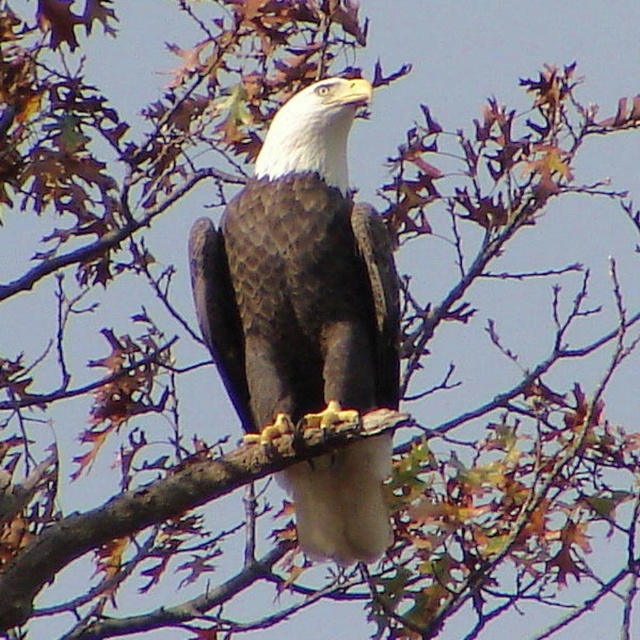
You are an ornithologist observing a bald eagle in its natural habitat. You notice the brown textured feathers at center and the brown rough tree branch at center. Which object occupies more space in the image?

The brown textured feathers at center is larger in size than the brown rough tree branch at center, so it occupies more space in the image.

You are a birdwatcher observing a bald eagle in its natural habitat. You notice a specific point marked at coordinates point (300,278). Based on the scene description, can you determine what part of the eagle this point is located on?

The point (300,278) is on brown textured feathers at center.

You are a birdwatcher observing a bald eagle in its natural habitat. You notice the brown textured feathers at center and the brown rough tree branch at center. Which object is located to the right of the other?

The brown textured feathers at center is positioned on the right side of brown rough tree branch at center.